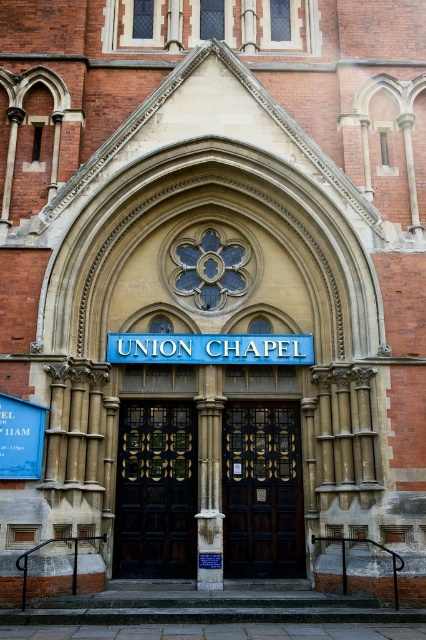
Question: Considering the real-world distances, which object is closest to the dark wood door at center?

Choices:
 (A) blue metallic sign at center
 (B) black polished wood door at center

Answer: (B)

Question: Which point appears closest to the camera in this image?

Choices:
 (A) (118, 465)
 (B) (235, 544)

Answer: (B)

Question: Considering the relative positions of black polished wood door at center and dark wood door at center in the image provided, where is black polished wood door at center located with respect to dark wood door at center?

Choices:
 (A) below
 (B) above

Answer: (B)

Question: From the image, what is the correct spatial relationship of dark wood door at center in relation to blue metallic sign at center?

Choices:
 (A) above
 (B) below

Answer: (B)

Question: Is black polished wood door at center to the left of blue metallic sign at center from the viewer's perspective?

Choices:
 (A) yes
 (B) no

Answer: (A)

Question: Among these objects, which one is farthest from the camera?

Choices:
 (A) blue metallic sign at center
 (B) black polished wood door at center
 (C) dark wood door at center

Answer: (A)